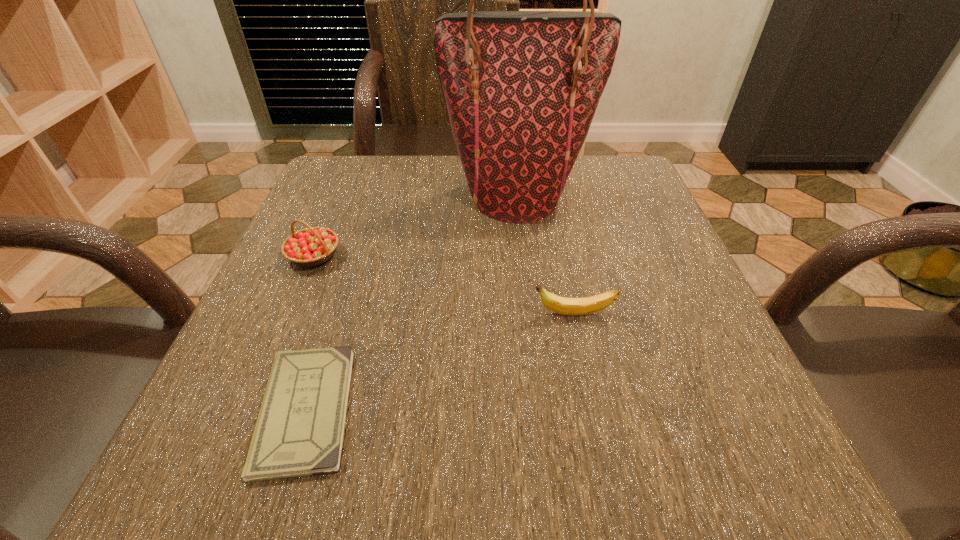
Locate an element on the screen. The image size is (960, 540). vacant space that's between the nearest object and the second shortest object is located at coordinates [x=440, y=362].

You are a GUI agent. You are given a task and a screenshot of the screen. Output one action in this format:
    pyautogui.click(x=<x>, y=<y>)
    Task: Click on the free area in between the shortest object and the second shortest object
    
    Given the screenshot: What is the action you would take?
    pyautogui.click(x=440, y=362)

Image resolution: width=960 pixels, height=540 pixels. I want to click on free space between the third shortest object and the third tallest object, so click(x=444, y=285).

At what (x,y) coordinates should I click in order to perform the action: click on vacant space in between the tallest object and the third nearest object. Please return your answer as a coordinate pair (x, y). This screenshot has height=540, width=960. Looking at the image, I should click on (416, 226).

Locate an element on the screen. Image resolution: width=960 pixels, height=540 pixels. free space between the farthest object and the banana is located at coordinates (544, 255).

This screenshot has height=540, width=960. In order to click on unoccupied position between the farthest object and the third nearest object in this screenshot , I will do `click(416, 226)`.

Identify the location of empty space that is in between the second nearest object and the strawberry. (444, 285).

The image size is (960, 540). Identify the location of free space between the tallest object and the third farthest object. (544, 255).

Locate which object ranks in proximity to the nearest object. Please provide its 2D coordinates. Your answer should be formatted as a tuple, i.e. [(x, y)], where the tuple contains the x and y coordinates of a point satisfying the conditions above.

[(312, 246)]

Where is `object that ranks as the second closest to the farthest object`? The image size is (960, 540). object that ranks as the second closest to the farthest object is located at coordinates (566, 306).